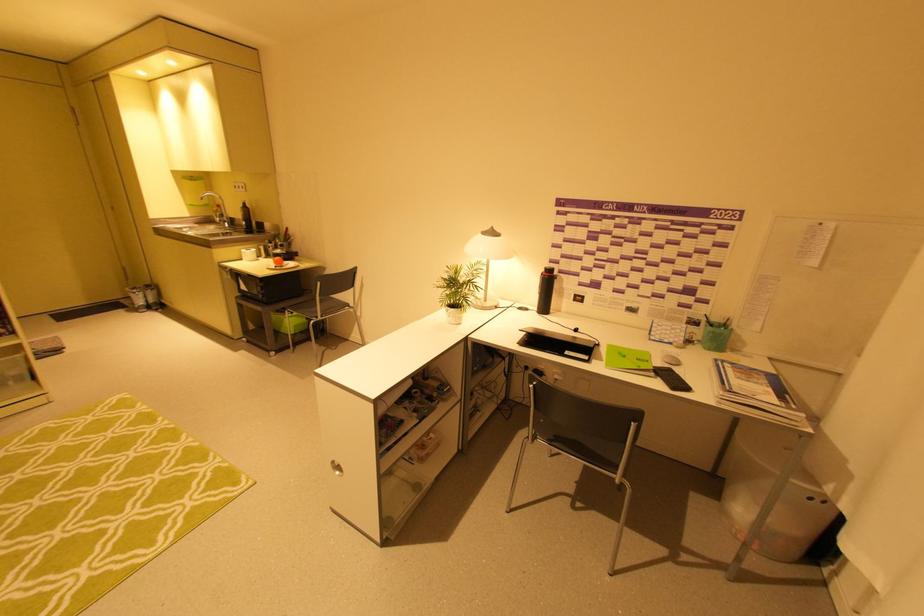
Describe the element at coordinates (545, 291) in the screenshot. I see `the black water bottle` at that location.